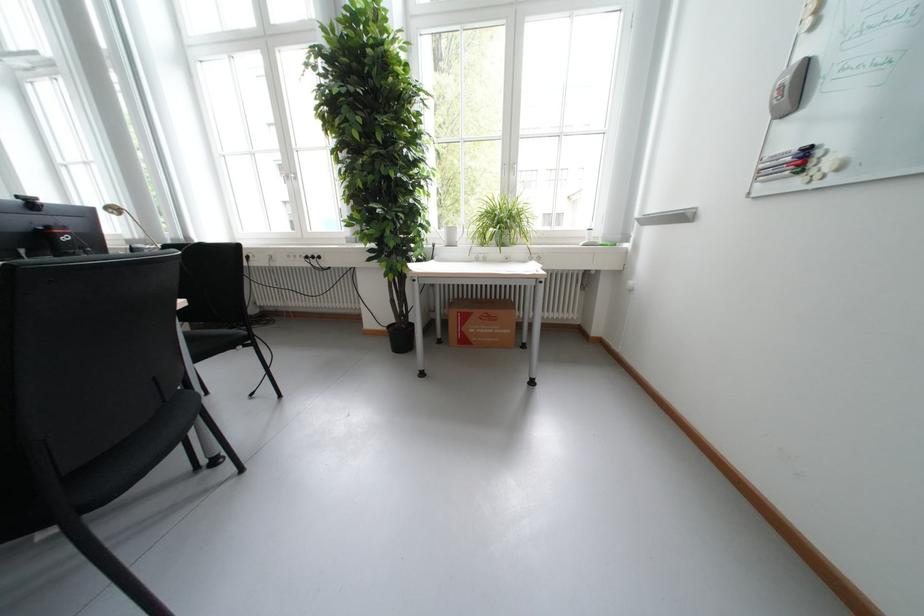
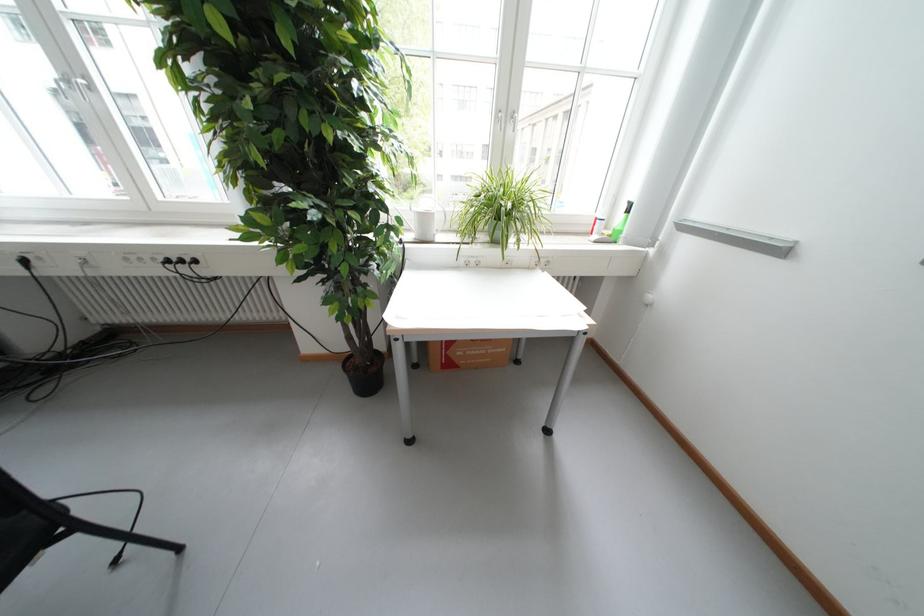
Based on the photo, what movement of the cameraman would produce the second image?

The cameraman moved toward left, forward.